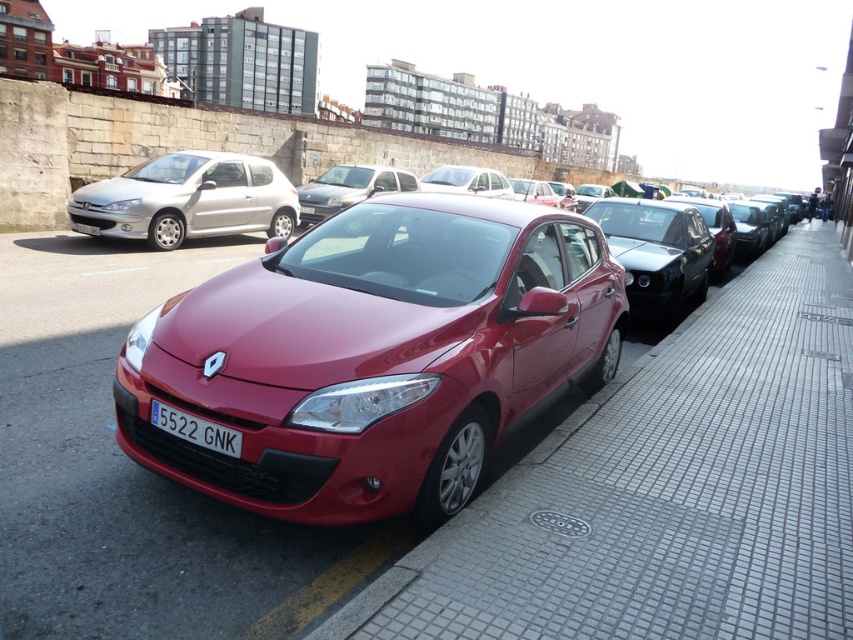
Does satin black sedan at center have a lesser width compared to glossy black sedan at center?

Indeed, satin black sedan at center has a lesser width compared to glossy black sedan at center.

From the picture: Is satin black sedan at center to the right of glossy black sedan at center from the viewer's perspective?

In fact, satin black sedan at center is to the left of glossy black sedan at center.

Is point (660, 289) positioned after point (712, 221)?

No, (660, 289) is in front of (712, 221).

Locate an element on the screen. satin black sedan at center is located at coordinates (656, 252).

Is satin burgundy sedan at center further to the viewer compared to satin black sedan at center?

That is False.

Is satin burgundy sedan at center to the left of satin black sedan at center from the viewer's perspective?

Correct, you'll find satin burgundy sedan at center to the left of satin black sedan at center.

Identify the location of satin burgundy sedan at center. The height and width of the screenshot is (640, 853). (373, 355).

Can you confirm if satin black sedan at center is thinner than satin silver sedan at center?

Yes.

Where is `satin black sedan at center`? satin black sedan at center is located at coordinates (656, 252).

Does point (631, 228) come closer to viewer compared to point (341, 170)?

Yes, it is.

What are the coordinates of `satin black sedan at center` in the screenshot? It's located at (656, 252).